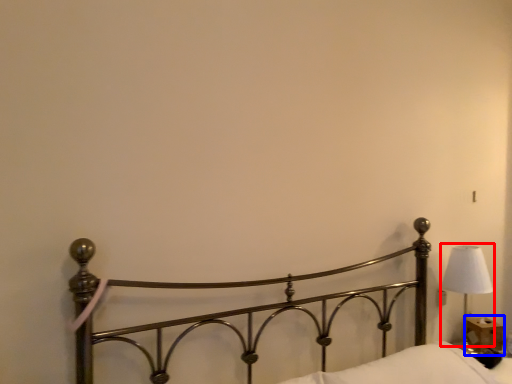
Question: Which object appears closest to the camera in this image, lamp (highlighted by a red box) or table (highlighted by a blue box)?

Choices:
 (A) lamp
 (B) table

Answer: (A)